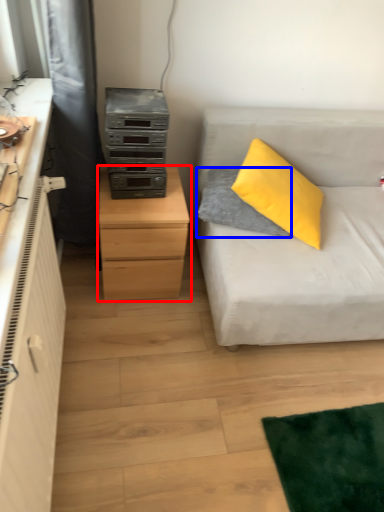
Question: Which of the following is the closest to the observer, chest of drawers (highlighted by a red box) or pillow (highlighted by a blue box)?

Choices:
 (A) chest of drawers
 (B) pillow

Answer: (A)